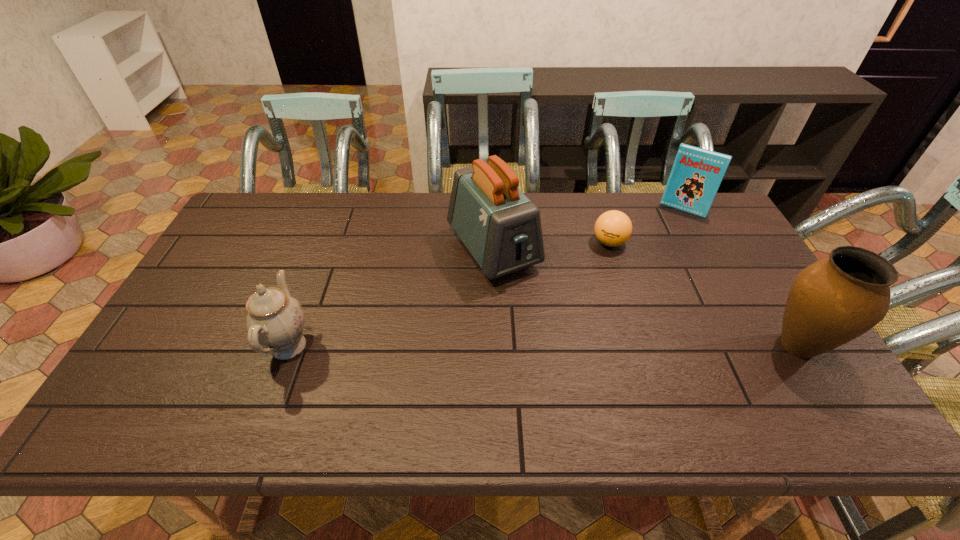
Find the location of a particular element. vacant spot on the desktop that is between the chinaware and the urn and is positioned on the side with brand of the shortest object is located at coordinates (484, 346).

Find the location of a particular element. The height and width of the screenshot is (540, 960). vacant space on the desktop that is between the chinaware and the urn and is positioned on the front-facing side of the toaster is located at coordinates (567, 346).

At what (x,y) coordinates should I click in order to perform the action: click on vacant space on the desktop that is between the chinaware and the urn and is positioned on the front cover of the book. Please return your answer as a coordinate pair (x, y). Looking at the image, I should click on (612, 346).